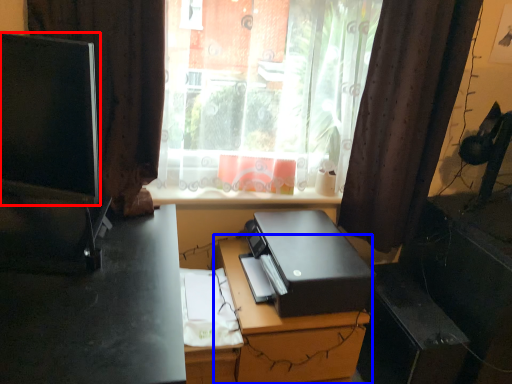
Question: Which of the following is the closest to the observer, computer monitor (highlighted by a red box) or computer desk (highlighted by a blue box)?

Choices:
 (A) computer monitor
 (B) computer desk

Answer: (A)